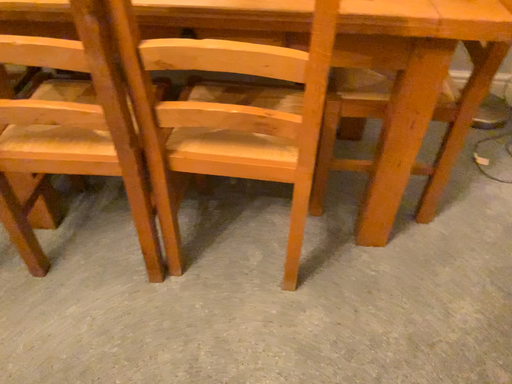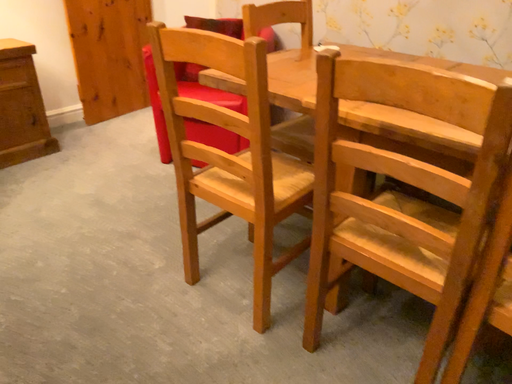
Question: Which way did the camera rotate in the video?

Choices:
 (A) rotated upward
 (B) rotated downward

Answer: (A)